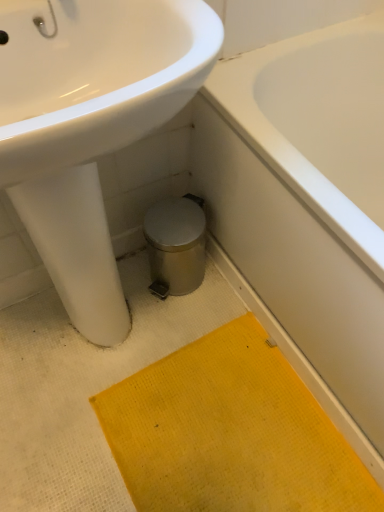
Question: Is yellow textured bath mat at lower center bigger than white glossy bathtub at lower right?

Choices:
 (A) no
 (B) yes

Answer: (A)

Question: Does yellow textured bath mat at lower center lie in front of white glossy bathtub at lower right?

Choices:
 (A) yes
 (B) no

Answer: (B)

Question: Is the surface of yellow textured bath mat at lower center in direct contact with white glossy bathtub at lower right?

Choices:
 (A) no
 (B) yes

Answer: (A)

Question: Does yellow textured bath mat at lower center have a smaller size compared to white glossy bathtub at lower right?

Choices:
 (A) yes
 (B) no

Answer: (A)

Question: From a real-world perspective, is yellow textured bath mat at lower center over white glossy bathtub at lower right?

Choices:
 (A) yes
 (B) no

Answer: (B)

Question: From a real-world perspective, is white glossy bathtub at lower right positioned above or below white glossy sink at upper left?

Choices:
 (A) above
 (B) below

Answer: (B)

Question: In the image, is white glossy bathtub at lower right positioned in front of or behind white glossy sink at upper left?

Choices:
 (A) behind
 (B) front

Answer: (A)

Question: Looking at their shapes, would you say white glossy bathtub at lower right is wider or thinner than white glossy sink at upper left?

Choices:
 (A) wide
 (B) thin

Answer: (A)

Question: From their relative heights in the image, would you say white glossy bathtub at lower right is taller or shorter than white glossy sink at upper left?

Choices:
 (A) short
 (B) tall

Answer: (A)

Question: Considering the relative positions of white glossy sink at upper left and white glossy bathtub at lower right in the image provided, is white glossy sink at upper left to the left or to the right of white glossy bathtub at lower right?

Choices:
 (A) right
 (B) left

Answer: (B)

Question: Is white glossy sink at upper left taller or shorter than white glossy bathtub at lower right?

Choices:
 (A) tall
 (B) short

Answer: (A)

Question: From the image's perspective, is white glossy sink at upper left positioned above or below white glossy bathtub at lower right?

Choices:
 (A) below
 (B) above

Answer: (A)

Question: From a real-world perspective, is white glossy sink at upper left above or below white glossy bathtub at lower right?

Choices:
 (A) above
 (B) below

Answer: (A)

Question: Is point (49, 151) positioned closer to the camera than point (294, 386)?

Choices:
 (A) farther
 (B) closer

Answer: (B)

Question: In terms of size, does white glossy sink at upper left appear bigger or smaller than yellow textured bath mat at lower center?

Choices:
 (A) big
 (B) small

Answer: (A)